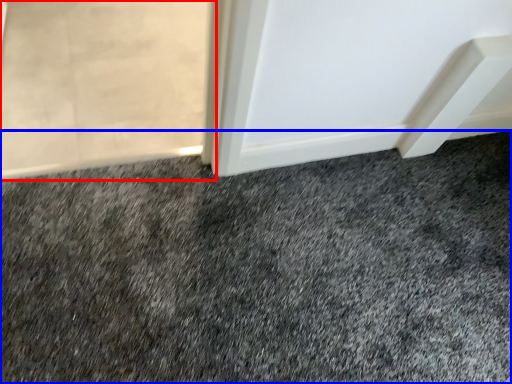
Question: Which object appears farthest to the camera in this image, screen door (highlighted by a red box) or granite (highlighted by a blue box)?

Choices:
 (A) screen door
 (B) granite

Answer: (A)